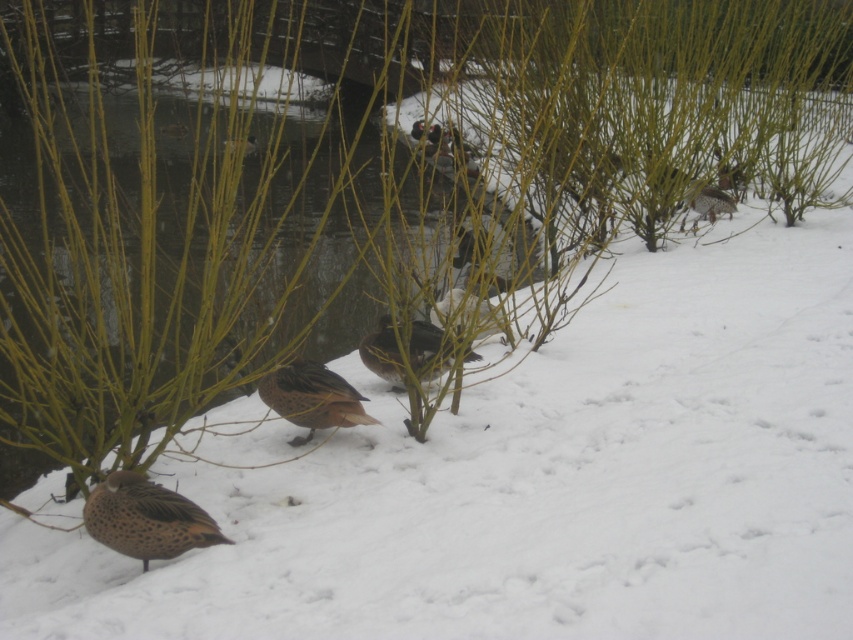
Is brown speckled feathers at center shorter than brown speckled duck at center?

No.

Who is more forward, (277, 408) or (399, 362)?

Point (277, 408) is in front.

Which is in front, point (358, 408) or point (428, 330)?

Point (358, 408)

In order to click on brown speckled feathers at center in this screenshot , I will do `click(312, 397)`.

Looking at this image, does speckled brown duck at lower left have a greater width compared to brown speckled duck at center?

In fact, speckled brown duck at lower left might be narrower than brown speckled duck at center.

What do you see at coordinates (146, 518) in the screenshot? This screenshot has width=853, height=640. I see `speckled brown duck at lower left` at bounding box center [146, 518].

Locate an element on the screen. Image resolution: width=853 pixels, height=640 pixels. speckled brown duck at lower left is located at coordinates (146, 518).

Identify the location of speckled brown duck at lower left. (146, 518).

Does speckled brown duck at lower left appear on the right side of brown speckled feathers at center?

Incorrect, speckled brown duck at lower left is not on the right side of brown speckled feathers at center.

The width and height of the screenshot is (853, 640). Find the location of `speckled brown duck at lower left`. speckled brown duck at lower left is located at coordinates (146, 518).